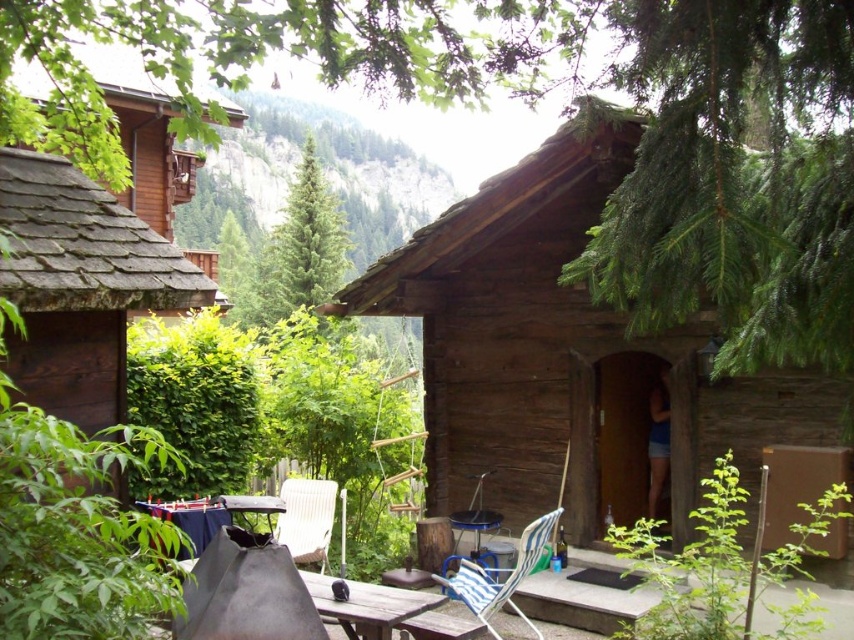
You are planning to set up a tent in the area near the green coniferous tree at center and the wooden picnic table at center. Which object would you need to consider for shade, and why?

The green coniferous tree at center is taller than the wooden picnic table at center, so it would provide more shade for setting up the tent.

You are planning to place a rectangular picnic basket that is 1 meter wide on the brown wooden table at lower center. The blue striped fabric chair at lower center is positioned to the right of the table. Is there enough space on the table to place the basket without overlapping the chair?

The brown wooden table at lower center might be wider than the blue striped fabric chair at lower center, so there might be enough space to place the picnic basket without overlapping the chair. However, since the exact width of the table isn not specified, it is uncertain.

You are standing in front of the brown wooden cabin at center and the white woven chair at center. Which object is positioned to the left?

The white woven chair at center is to the left of the brown wooden cabin at center.